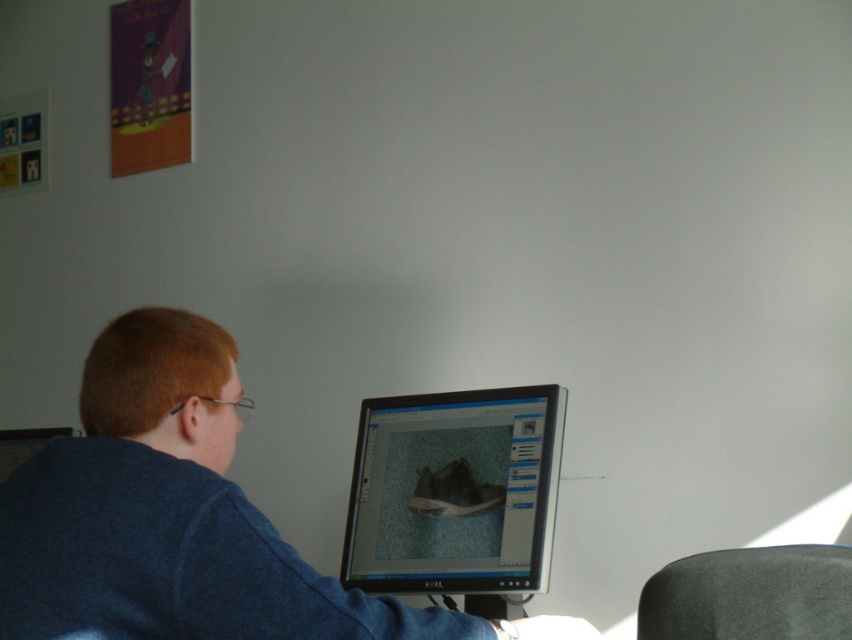
Who is shorter, blue cotton shirt at center or satin black monitor at center?

With less height is satin black monitor at center.

In the scene shown: Is blue cotton shirt at center wider than satin black monitor at center?

Indeed, blue cotton shirt at center has a greater width compared to satin black monitor at center.

Does point (4, 488) come behind point (439, 529)?

No, (4, 488) is in front of (439, 529).

Where is `blue cotton shirt at center`? This screenshot has height=640, width=852. blue cotton shirt at center is located at coordinates (177, 516).

Can you confirm if satin black monitor at center is smaller than black matte chair at lower right?

No.

Is satin black monitor at center to the left of black matte chair at lower right from the viewer's perspective?

Yes, satin black monitor at center is to the left of black matte chair at lower right.

Is point (476, 556) farther from camera compared to point (821, 545)?

Yes, it is.

Find the location of a particular element. The width and height of the screenshot is (852, 640). satin black monitor at center is located at coordinates (453, 492).

Looking at this image, which of these two, blue cotton shirt at center or black matte chair at lower right, stands shorter?

With less height is black matte chair at lower right.

Does blue cotton shirt at center have a greater height compared to black matte chair at lower right?

Correct, blue cotton shirt at center is much taller as black matte chair at lower right.

Which is in front, point (27, 609) or point (661, 566)?

Point (27, 609) is in front.

Locate an element on the screen. The width and height of the screenshot is (852, 640). blue cotton shirt at center is located at coordinates (177, 516).